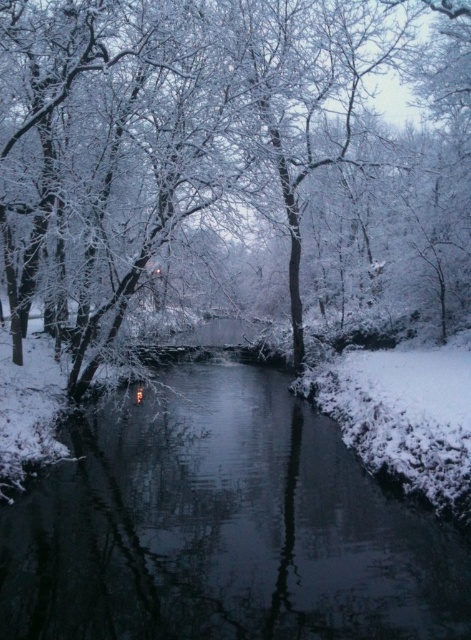
Question: Which point is farther to the camera?

Choices:
 (A) white frosty tree at center
 (B) glossy dark water at center

Answer: (A)

Question: Is white frosty tree at center positioned behind glossy dark water at center?

Choices:
 (A) yes
 (B) no

Answer: (A)

Question: Among these points, which one is farthest from the camera?

Choices:
 (A) (113, 426)
 (B) (326, 221)

Answer: (B)

Question: Which point is farther to the camera?

Choices:
 (A) white frosty tree at center
 (B) glossy dark water at center

Answer: (A)

Question: Is white frosty tree at center smaller than glossy dark water at center?

Choices:
 (A) no
 (B) yes

Answer: (A)

Question: Does white frosty tree at center come in front of glossy dark water at center?

Choices:
 (A) no
 (B) yes

Answer: (A)